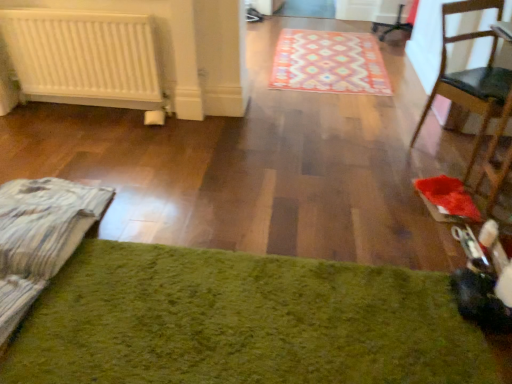
Locate an element on the screen. The image size is (512, 384). vacant space situated above white matte radiator at left (from a real-world perspective) is located at coordinates (73, 7).